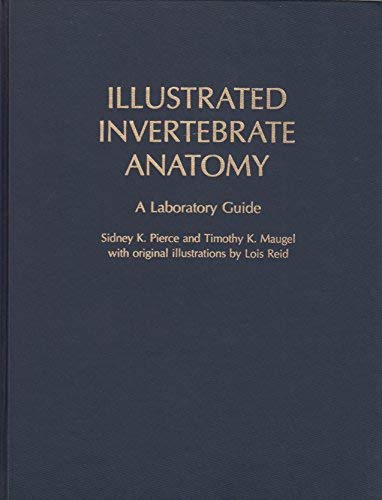
Image resolution: width=382 pixels, height=500 pixels. Find the location of `book`. book is located at coordinates (255, 325).